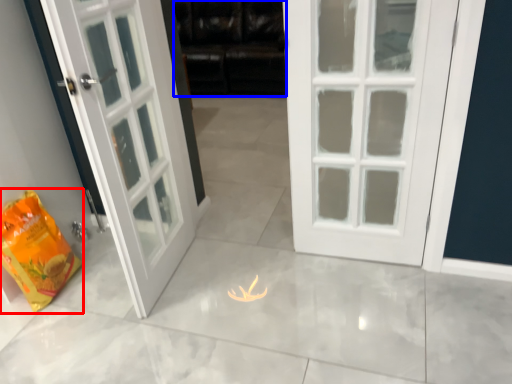
Question: Which of the following is the closest to the observer, shopping bag (highlighted by a red box) or dark (highlighted by a blue box)?

Choices:
 (A) shopping bag
 (B) dark

Answer: (A)